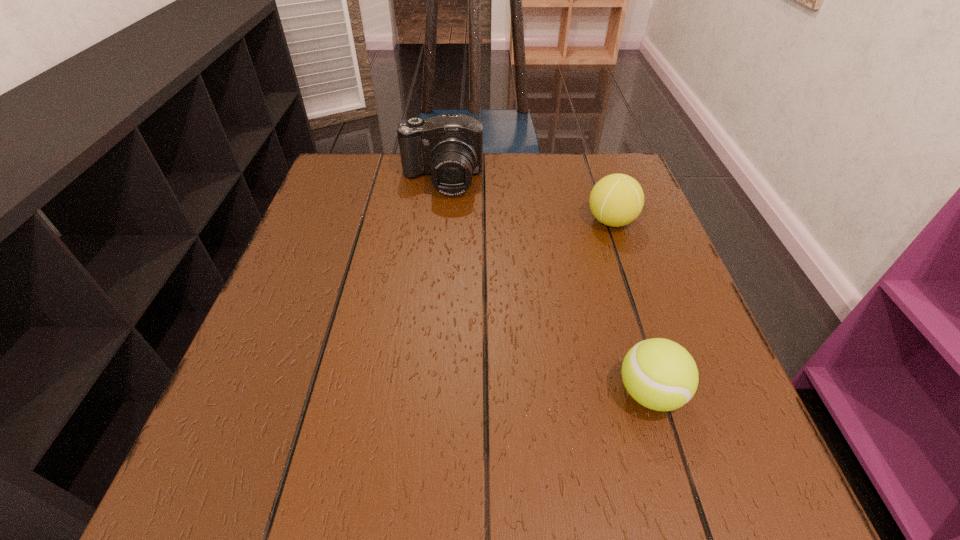
Identify the location of vacant space that is in between the second nearest object and the nearest object. (631, 307).

The height and width of the screenshot is (540, 960). I want to click on vacant region between the second nearest object and the tallest object, so click(526, 201).

I want to click on unoccupied area between the farthest object and the second nearest object, so click(526, 201).

Select which object appears as the closest to the leftmost object. Please provide its 2D coordinates. Your answer should be formatted as a tuple, i.e. [(x, y)], where the tuple contains the x and y coordinates of a point satisfying the conditions above.

[(616, 200)]

Point out which object is positioned as the second nearest to the camera. Please provide its 2D coordinates. Your answer should be formatted as a tuple, i.e. [(x, y)], where the tuple contains the x and y coordinates of a point satisfying the conditions above.

[(660, 374)]

Find the location of a particular element. blank area in the image that satisfies the following two spatial constraints: 1. on the lens of the nearer tennis ball; 2. on the left side of the tallest object is located at coordinates (418, 393).

Locate an element on the screen. blank area in the image that satisfies the following two spatial constraints: 1. on the lens of the farther tennis ball; 2. on the left side of the camera is located at coordinates (437, 221).

Identify the location of vacant region that satisfies the following two spatial constraints: 1. on the lens of the farthest object; 2. on the right side of the nearest object. (418, 393).

Identify the location of free region that satisfies the following two spatial constraints: 1. on the lens of the farthest object; 2. on the right side of the second farthest object. (437, 221).

Where is `vacant region that satisfies the following two spatial constraints: 1. on the lens of the camera; 2. on the right side of the nearest object`? Image resolution: width=960 pixels, height=540 pixels. vacant region that satisfies the following two spatial constraints: 1. on the lens of the camera; 2. on the right side of the nearest object is located at coordinates (418, 393).